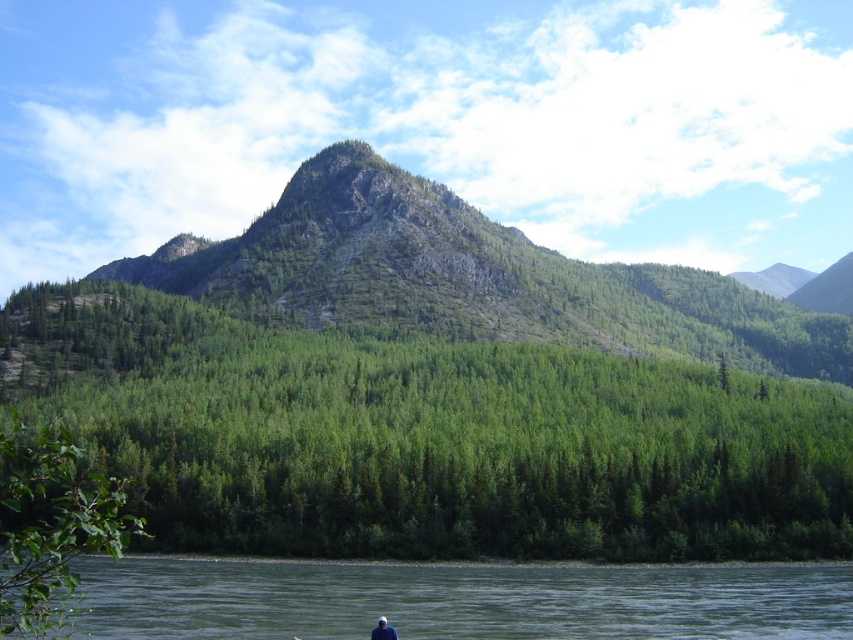
You are standing at point (x=657, y=564) and want to walk to the mountain peak in the background. Is point (x=318, y=355) located between you and the mountain peak?

Yes, point (x=318, y=355) is located between you and the mountain peak because it is behind point (x=657, y=564) where you are standing.

You are standing at the edge of the green smooth water at lower center and want to walk towards the green leafy forest at center. Which direction should you go to reach the forest?

To reach the green leafy forest at center from the green smooth water at lower center, you should walk towards the center of the image, as the forest is wider than the water and occupies the central area.